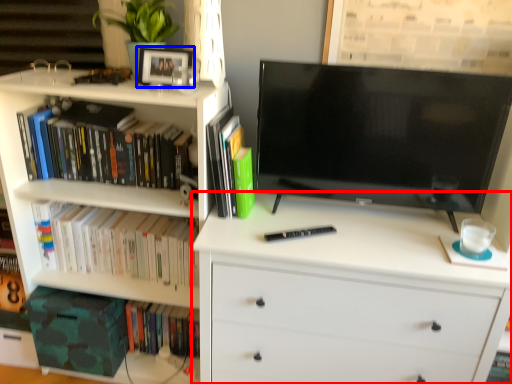
Question: Which of the following is the farthest to the observer, chest of drawers (highlighted by a red box) or picture frame (highlighted by a blue box)?

Choices:
 (A) chest of drawers
 (B) picture frame

Answer: (B)